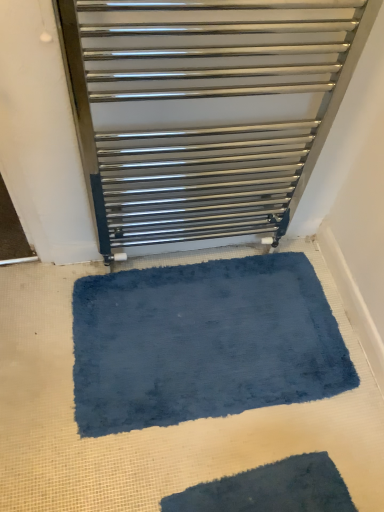
Find the location of `vacant space underneath blue plush bath mat at center, positioned as the second bath mat in bottom-to-top order (from a real-world perspective)`. vacant space underneath blue plush bath mat at center, positioned as the second bath mat in bottom-to-top order (from a real-world perspective) is located at coordinates (205, 334).